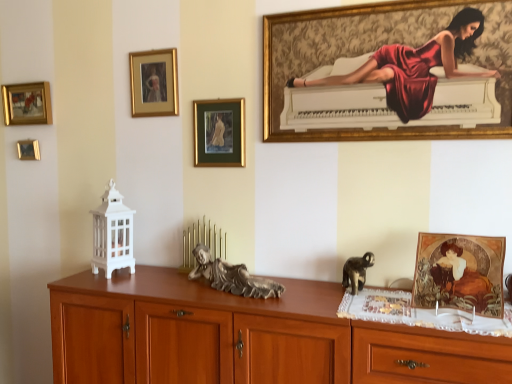
Find the location of a particular element. The image size is (512, 384). empty space that is ontop of gold-framed painting at upper center, arranged as the 1th picture frame when viewed from the front is located at coordinates (345, 4).